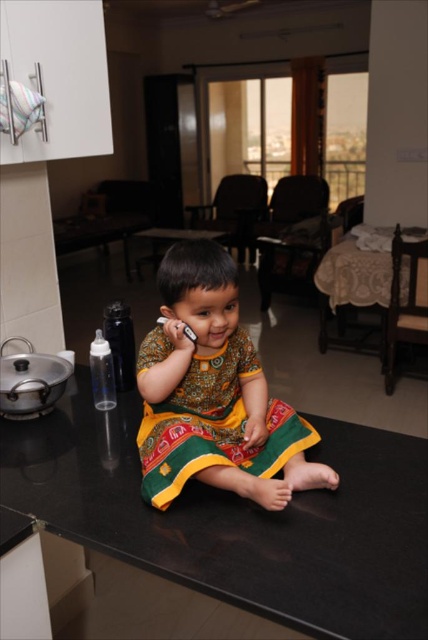
You are a parent trying to place a new toy on the black granite table at lower center and the wooden table at center. Which table should you choose if you want to place a larger toy?

The black granite table at lower center might be wider than wooden table at center, so it can accommodate a larger toy.

You are a parent trying to place a baby bottle on the black granite table at lower center and the printed cotton dress at center. Which surface is more suitable for placing the baby bottle?

The black granite table at lower center is more suitable for placing the baby bottle because it is a solid surface, unlike the printed cotton dress at center which is a fabric and cannot hold objects.